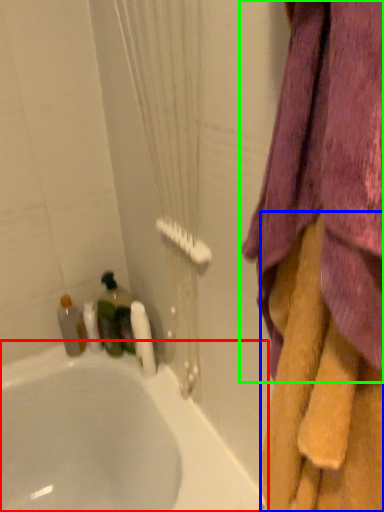
Question: Considering the real-world distances, which object is closest to bathtub (highlighted by a red box)? towel (highlighted by a blue box) or curtain (highlighted by a green box).

Choices:
 (A) towel
 (B) curtain

Answer: (A)